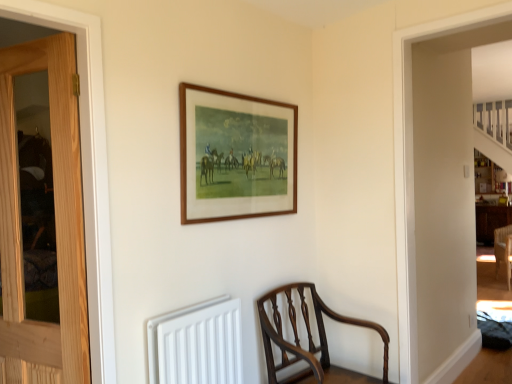
Question: Considering the relative sizes of white matte radiator at lower center and mahogany wood chair at lower center in the image provided, is white matte radiator at lower center bigger than mahogany wood chair at lower center?

Choices:
 (A) yes
 (B) no

Answer: (B)

Question: Does white matte radiator at lower center have a greater width compared to mahogany wood chair at lower center?

Choices:
 (A) yes
 (B) no

Answer: (B)

Question: Is white matte radiator at lower center at the left side of mahogany wood chair at lower center?

Choices:
 (A) no
 (B) yes

Answer: (B)

Question: Does white matte radiator at lower center appear on the right side of mahogany wood chair at lower center?

Choices:
 (A) yes
 (B) no

Answer: (B)

Question: Is white matte radiator at lower center not near mahogany wood chair at lower center?

Choices:
 (A) yes
 (B) no

Answer: (B)

Question: From a real-world perspective, is wooden picture frame at upper center physically located above or below mahogany wood chair at lower center?

Choices:
 (A) below
 (B) above

Answer: (B)

Question: From the image's perspective, is wooden picture frame at upper center located above or below mahogany wood chair at lower center?

Choices:
 (A) below
 (B) above

Answer: (B)

Question: Is wooden picture frame at upper center bigger or smaller than mahogany wood chair at lower center?

Choices:
 (A) small
 (B) big

Answer: (A)

Question: Considering the positions of point (193, 148) and point (276, 334), is point (193, 148) closer or farther from the camera than point (276, 334)?

Choices:
 (A) closer
 (B) farther

Answer: (A)

Question: In the image, is wooden picture frame at upper center positioned in front of or behind white matte radiator at lower center?

Choices:
 (A) front
 (B) behind

Answer: (B)

Question: From the image's perspective, is wooden picture frame at upper center located above or below white matte radiator at lower center?

Choices:
 (A) below
 (B) above

Answer: (B)

Question: Is point (197, 196) positioned closer to the camera than point (220, 331)?

Choices:
 (A) closer
 (B) farther

Answer: (B)

Question: Considering the positions of wooden picture frame at upper center and white matte radiator at lower center in the image, is wooden picture frame at upper center taller or shorter than white matte radiator at lower center?

Choices:
 (A) short
 (B) tall

Answer: (B)

Question: Considering the relative positions of wooden picture frame at upper center and light brown wood door at left in the image provided, is wooden picture frame at upper center to the left or to the right of light brown wood door at left?

Choices:
 (A) left
 (B) right

Answer: (B)

Question: Is wooden picture frame at upper center spatially inside light brown wood door at left, or outside of it?

Choices:
 (A) outside
 (B) inside

Answer: (A)